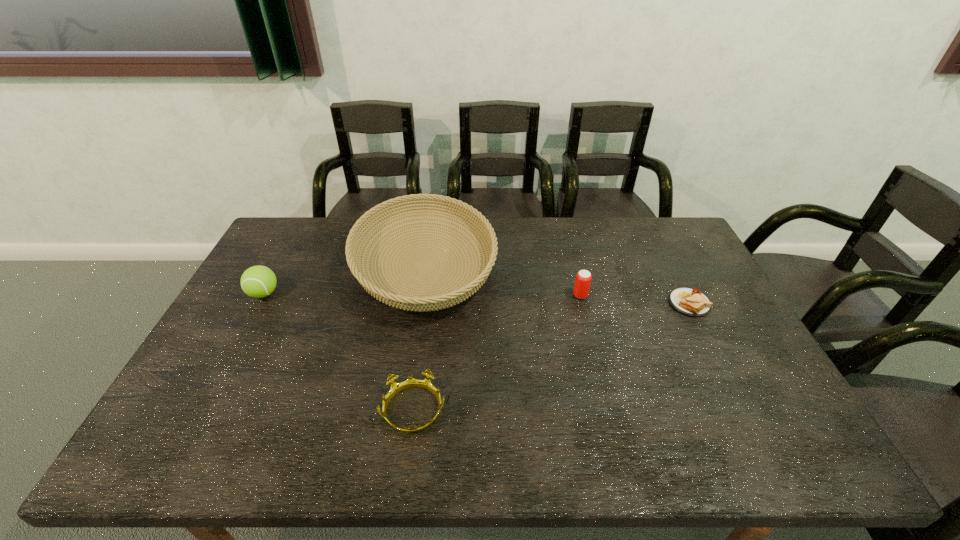
Identify the location of unoccupied position between the tennis ball and the basket. (345, 280).

This screenshot has width=960, height=540. Identify the location of free space that is in between the sandwich and the basket. (557, 285).

Identify the location of object that stands as the third closest to the tennis ball. (583, 278).

Choose which object is the second nearest neighbor to the leftmost object. Please provide its 2D coordinates. Your answer should be formatted as a tuple, i.e. [(x, y)], where the tuple contains the x and y coordinates of a point satisfying the conditions above.

[(426, 384)]